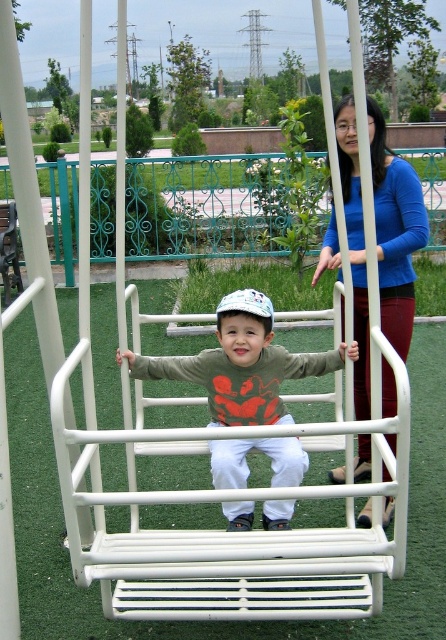
You are a clothing designer observing the playground scene. You need to determine which clothing item is narrower between the blue fabric shirt at upper center and the matte green sweatshirt at center. Which one is narrower?

The blue fabric shirt at upper center is narrower than the matte green sweatshirt at center.

You are a photographer trying to capture a photo of the blue fabric shirt at upper center and the matte green sweatshirt at center. Based on their positions, which clothing item would appear larger in the photo?

The blue fabric shirt at upper center appears larger in the photo because it is taller than the matte green sweatshirt at center.